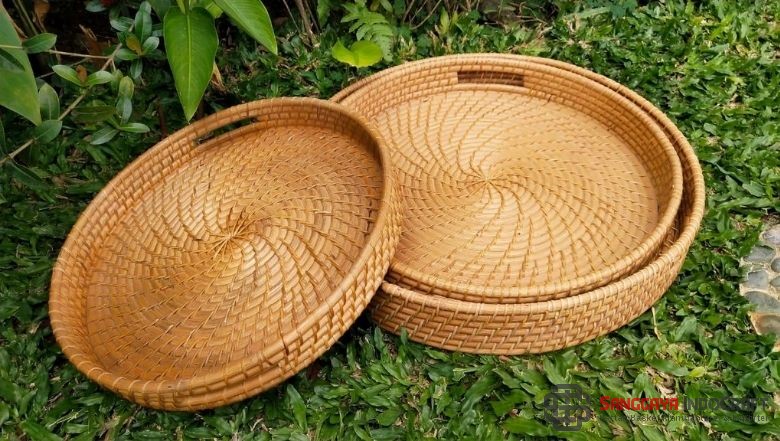
The width and height of the screenshot is (780, 441). I want to click on wicker rattan style baskets, so click(x=250, y=257), click(x=513, y=199), click(x=564, y=335).